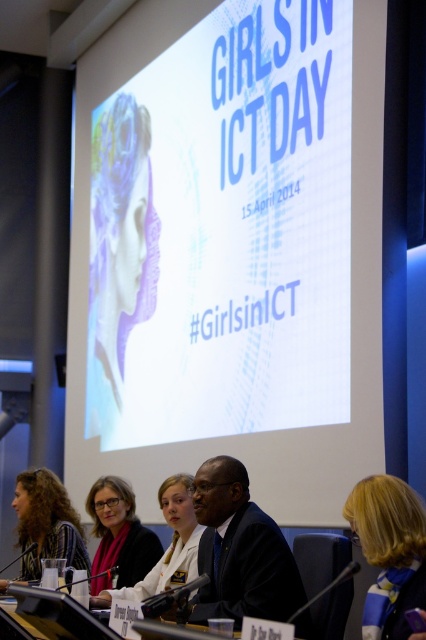
Question: Does blonde hair at lower right have a lesser width compared to curly hair at lower left?

Choices:
 (A) yes
 (B) no

Answer: (A)

Question: Is matte purple dress at upper left positioned behind dark blue suit at center?

Choices:
 (A) yes
 (B) no

Answer: (A)

Question: From the image, what is the correct spatial relationship of white matte projection screen at upper center in relation to curly hair at lower left?

Choices:
 (A) left
 (B) right

Answer: (B)

Question: Which object is the closest to the matte purple dress at upper left?

Choices:
 (A) white matte projection screen at upper center
 (B) matte black jacket at lower left
 (C) dark blue suit at center

Answer: (A)

Question: Which of the following is the closest to the observer?

Choices:
 (A) matte black jacket at lower left
 (B) blonde hair at lower right

Answer: (B)

Question: Which object is the farthest from the curly hair at lower left?

Choices:
 (A) matte purple dress at upper left
 (B) dark blue suit at center
 (C) blonde hair at lower right
 (D) white matte projection screen at upper center

Answer: (C)